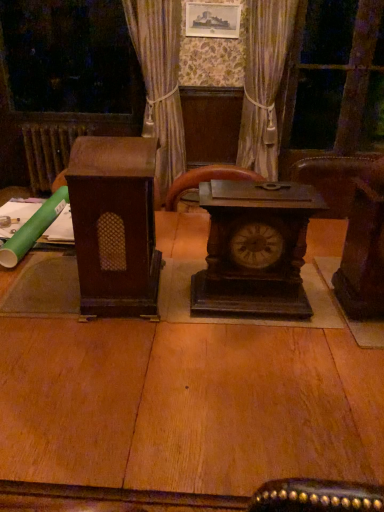
At what (x,y) coordinates should I click in order to perform the action: click on vacant space situated on the left part of dark brown wood clock at center. Please return your answer as a coordinate pair (x, y). This screenshot has height=512, width=384. Looking at the image, I should click on (175, 308).